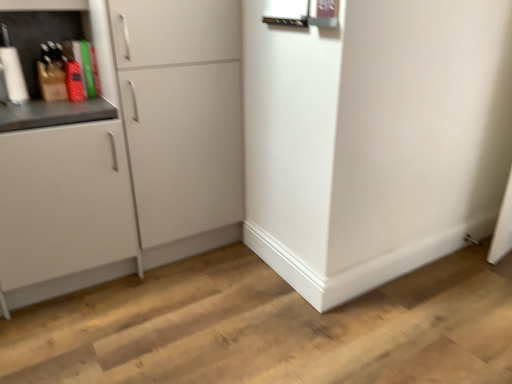
Question: From the image's perspective, is white matte cabinet at left, the 1th cabinetry from the left, above or below white matte cabinet at left, which is the first cabinetry from right to left?

Choices:
 (A) above
 (B) below

Answer: (B)

Question: Do you think white matte cabinet at left, placed as the second cabinetry when sorted from right to left, is within white matte cabinet at left, which is the 2th cabinetry in left-to-right order, or outside of it?

Choices:
 (A) inside
 (B) outside

Answer: (B)

Question: Considering the positions of white matte cabinet at left, placed as the second cabinetry when sorted from right to left, and white matte cabinet at left, which is the 2th cabinetry in left-to-right order, in the image, is white matte cabinet at left, placed as the second cabinetry when sorted from right to left, wider or thinner than white matte cabinet at left, which is the 2th cabinetry in left-to-right order,?

Choices:
 (A) thin
 (B) wide

Answer: (B)

Question: Is point click(x=160, y=94) closer or farther from the camera than point click(x=26, y=243)?

Choices:
 (A) farther
 (B) closer

Answer: (A)

Question: In terms of width, does white matte cabinet at left, which is the 2th cabinetry in left-to-right order, look wider or thinner when compared to white matte cabinet at left, placed as the second cabinetry when sorted from right to left?

Choices:
 (A) thin
 (B) wide

Answer: (A)

Question: Is white matte cabinet at left, which is the first cabinetry from right to left, spatially inside white matte cabinet at left, placed as the second cabinetry when sorted from right to left, or outside of it?

Choices:
 (A) inside
 (B) outside

Answer: (B)

Question: Is white matte cabinet at left, which is the first cabinetry from right to left, bigger or smaller than white matte cabinet at left, placed as the second cabinetry when sorted from right to left?

Choices:
 (A) big
 (B) small

Answer: (A)